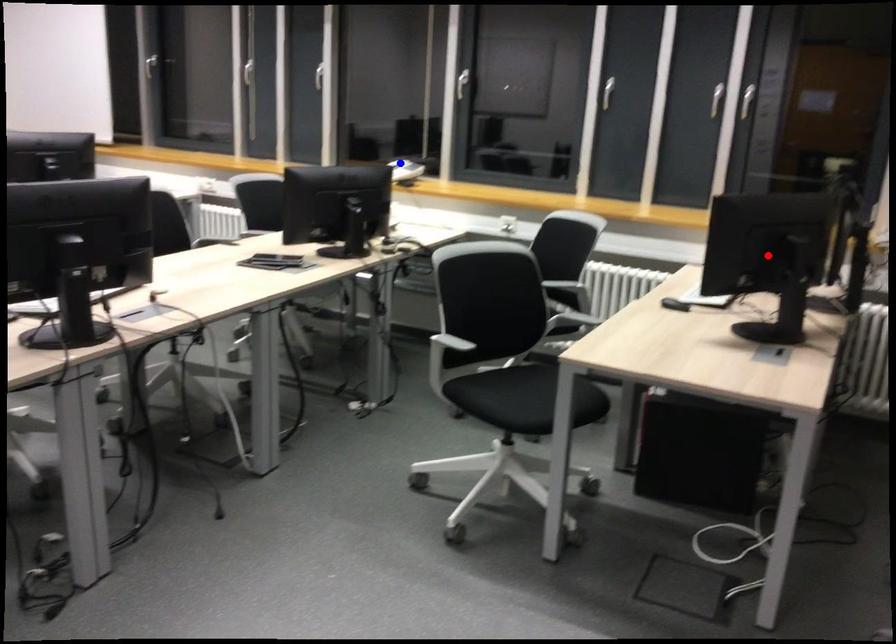
Question: Two points are marked on the image. Which point is closer to the camera?

Choices:
 (A) Blue point is closer.
 (B) Red point is closer.

Answer: (B)